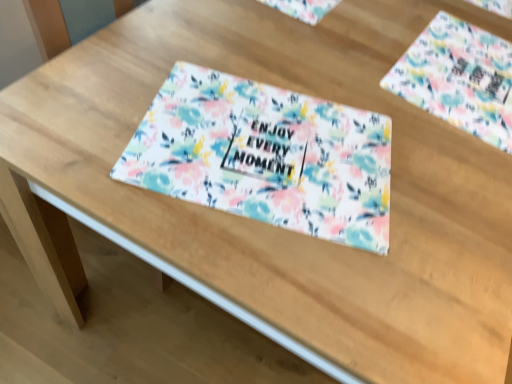
Identify the location of free space to the right of floral fabric placemat at center. The height and width of the screenshot is (384, 512). (445, 190).